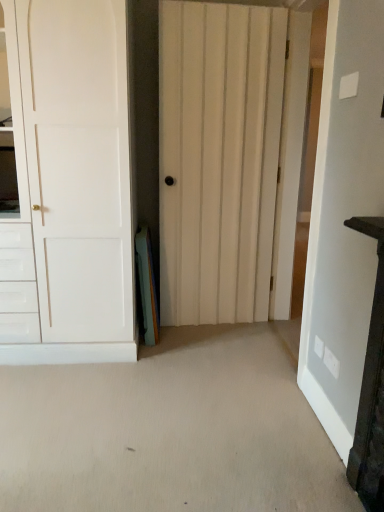
Question: Looking at their shapes, would you say dark wood vanity at right is wider or thinner than white wooden door at center, the first door in the right-to-left sequence?

Choices:
 (A) thin
 (B) wide

Answer: (B)

Question: Considering their positions, is dark wood vanity at right located in front of or behind white wooden door at center, the first door in the right-to-left sequence?

Choices:
 (A) front
 (B) behind

Answer: (A)

Question: Which is farther from the dark wood vanity at right?

Choices:
 (A) white wood door at center, which is the second door from right to left
 (B) white wooden door at center, the first door in the right-to-left sequence
 (C) white matte door at left, the 1th door in the left-to-right sequence

Answer: (C)

Question: Which object is positioned closest to the white wood door at center, positioned as the second door in left-to-right order?

Choices:
 (A) dark wood vanity at right
 (B) white matte door at left, the 1th door in the left-to-right sequence
 (C) white wooden door at center, the first door in the right-to-left sequence

Answer: (B)